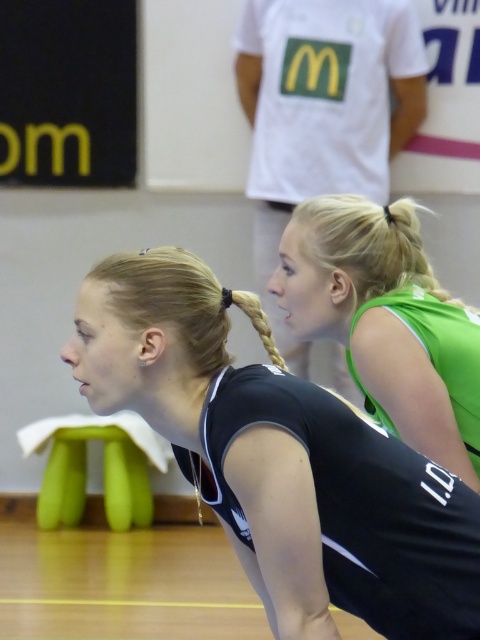
The width and height of the screenshot is (480, 640). Describe the element at coordinates (279, 458) in the screenshot. I see `black matte uniform at center` at that location.

Image resolution: width=480 pixels, height=640 pixels. Find the location of `black matte uniform at center`. black matte uniform at center is located at coordinates (279, 458).

Where is `black matte uniform at center`? The width and height of the screenshot is (480, 640). black matte uniform at center is located at coordinates tap(279, 458).

Who is lower down, black matte uniform at center or green jersey at upper center?

black matte uniform at center is below.

Which is behind, point (280, 531) or point (272, 97)?

Point (272, 97)

Does point (162, 422) come farther from viewer compared to point (385, 140)?

That is False.

I want to click on black matte uniform at center, so click(x=279, y=458).

Does green jersey at upper center have a lesser width compared to green jersey at upper right?

Incorrect, green jersey at upper center's width is not less than green jersey at upper right's.

Between point (354, 136) and point (466, 360), which one is positioned in front?

Point (466, 360) is more forward.

You are a GUI agent. You are given a task and a screenshot of the screen. Output one action in this format:
    pyautogui.click(x=<x>, y=<y>)
    Task: Click on the green jersey at upper center
    
    Given the screenshot: What is the action you would take?
    pyautogui.click(x=322, y=113)